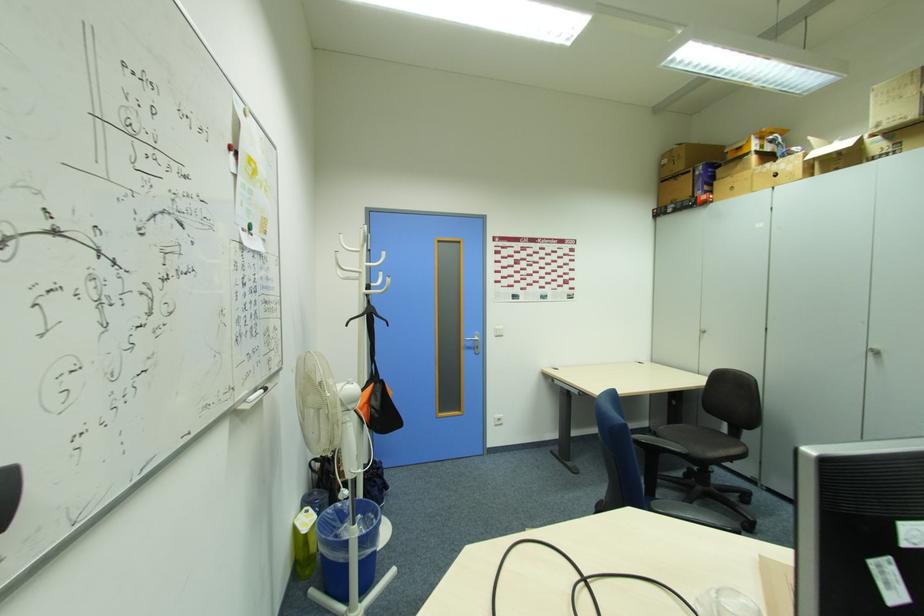
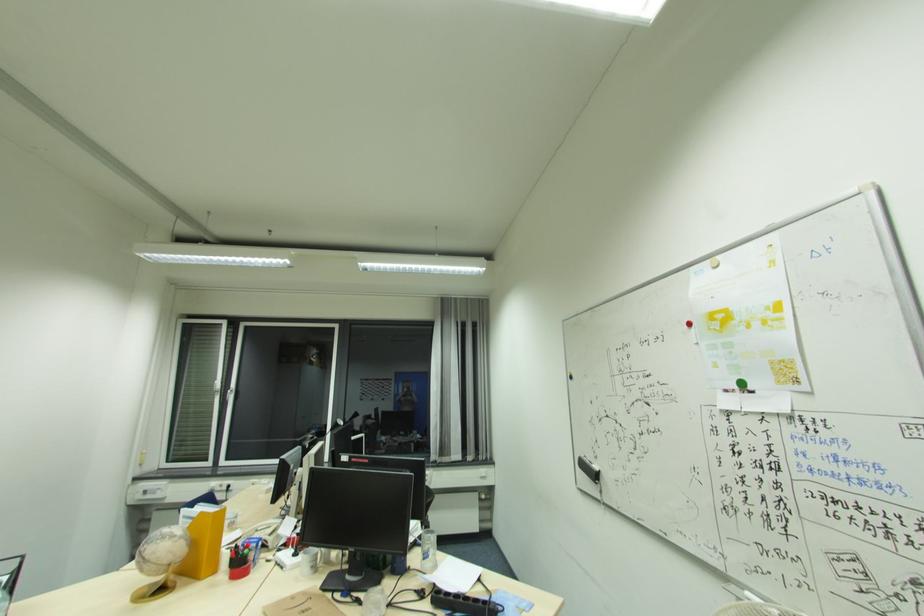
Find the pixel in the second image that matches point 249,229 in the first image.

(739, 387)